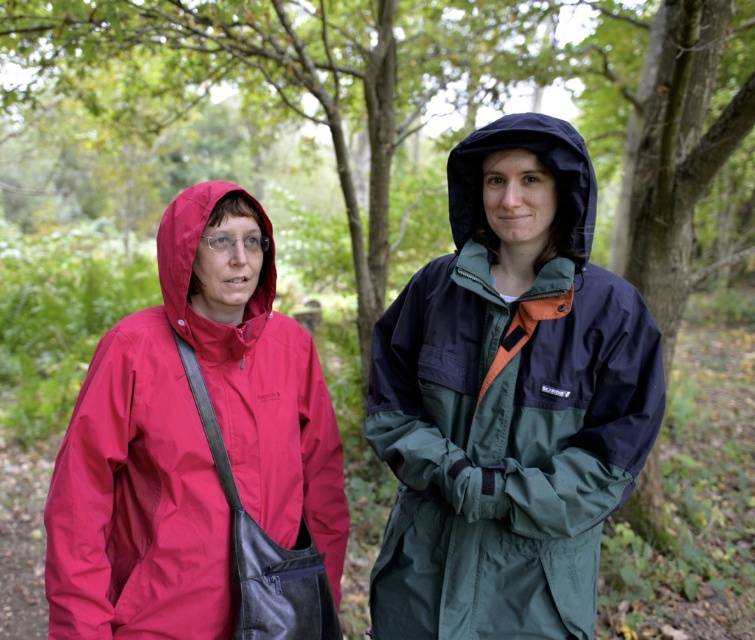
You are planning to take a photo of the matte red jacket at left and the black matte hood at upper center. Which object should you zoom in on to ensure both are in the frame without moving the camera? Explain your reasoning based on their sizes.

The matte red jacket at left is wider than the black matte hood at upper center. To include both in the frame without moving the camera, you should zoom in on the matte red jacket at left since it is the wider object, allowing the smaller black matte hood at upper center to also fit within the same field of view.

You are planning to take a photo of the two people in the forest. You need to ensure that both the green matte jacket at center and the matte red raincoat at left are fully visible in the frame. Given their heights, which person should be positioned closer to the camera to avoid one blocking the other?

The green matte jacket at center is taller than the matte red raincoat at left. To ensure both are fully visible, the shorter matte red raincoat at left should be positioned closer to the camera so the taller green matte jacket at center doesn